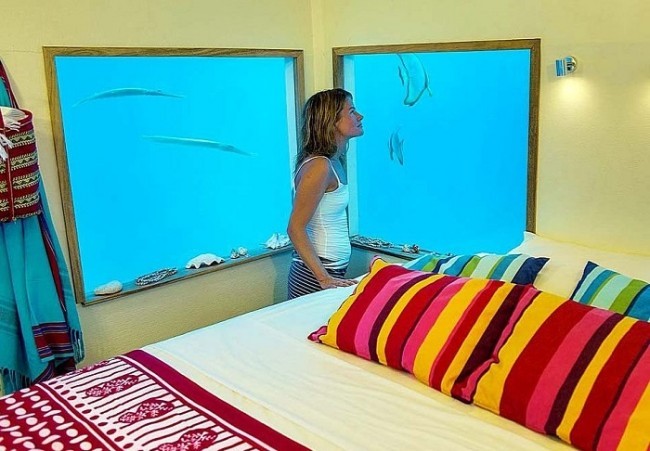
Where is `white sheets`? white sheets is located at coordinates (326, 405).